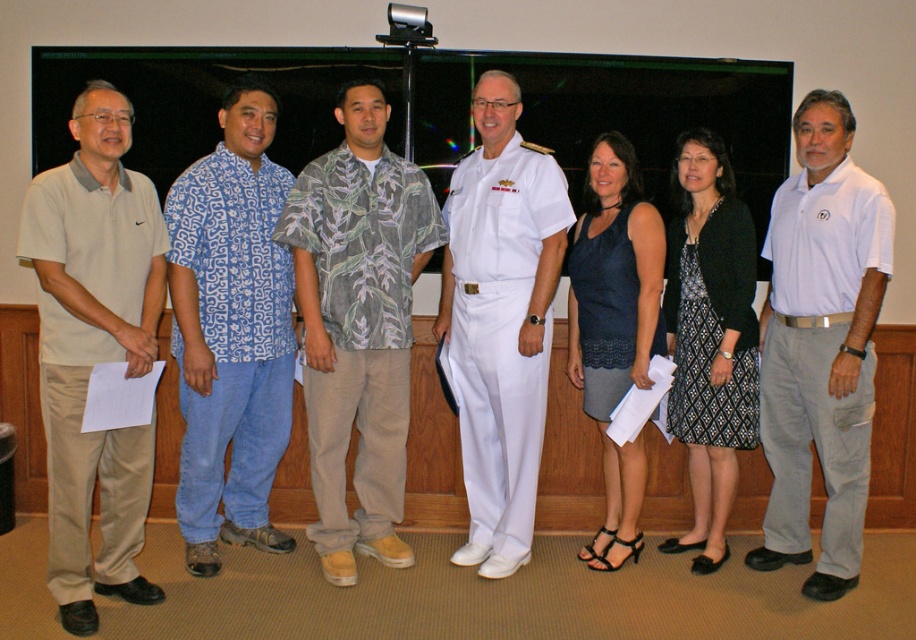
In the scene shown: Between printed fabric shirt at center and navy blue fabric dress at center, which one appears on the right side from the viewer's perspective?

navy blue fabric dress at center

Is printed fabric shirt at center shorter than navy blue fabric dress at center?

In fact, printed fabric shirt at center may be taller than navy blue fabric dress at center.

The image size is (916, 640). Identify the location of printed fabric shirt at center. (358, 324).

This screenshot has width=916, height=640. Identify the location of printed fabric shirt at center. (358, 324).

Does blue printed shirt at center have a lesser width compared to white uniform at center?

Yes, blue printed shirt at center is thinner than white uniform at center.

Is blue printed shirt at center to the left of white uniform at center from the viewer's perspective?

Indeed, blue printed shirt at center is positioned on the left side of white uniform at center.

Which is in front, point (260, 452) or point (489, 422)?

Positioned in front is point (489, 422).

This screenshot has width=916, height=640. I want to click on blue printed shirt at center, so click(x=231, y=330).

Is white cotton polo shirt at right to the left of navy blue fabric dress at center from the viewer's perspective?

Incorrect, white cotton polo shirt at right is not on the left side of navy blue fabric dress at center.

Does point (812, 438) lie behind point (636, 499)?

That is False.

The image size is (916, 640). I want to click on white cotton polo shirt at right, so (820, 346).